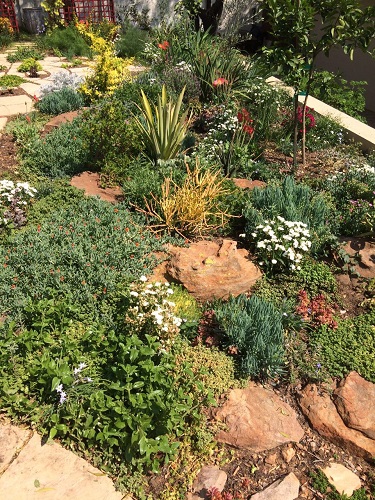
Locate an element on the screen. This screenshot has height=500, width=375. wall is located at coordinates (149, 6).